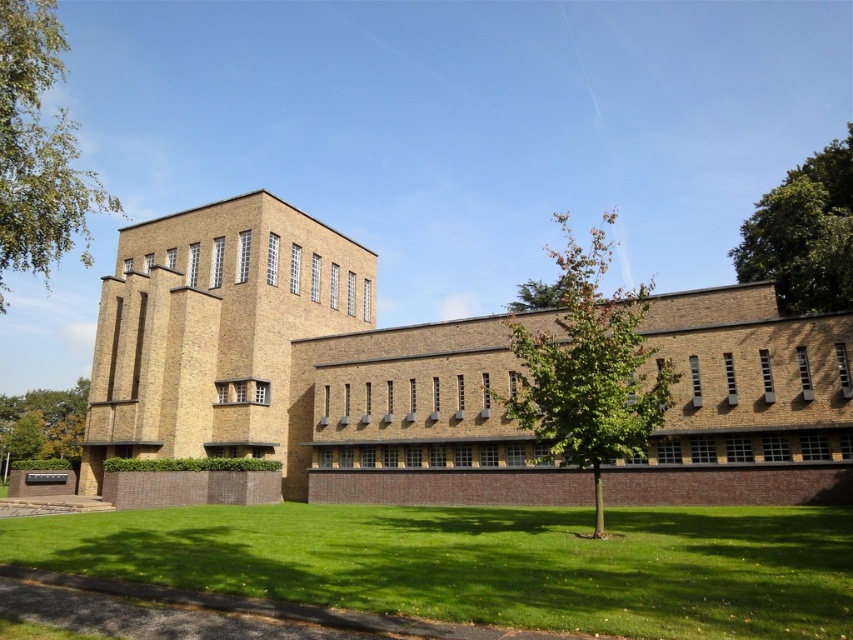
You are standing 20 meters away from the modernist building. You notice a green leafy tree at left. Is the tree closer to you than the building?

The distance of green leafy tree at left from viewer is 18.49 meters, so yes, the tree is closer to you than the building since it is only 18.49 meters away compared to your 20 meters distance from the building.

You are standing in front of the modernist building and notice two green leafy trees. One is labeled as the green leafy tree at left, and the other is the green leafy tree at lower left. Which tree would appear larger in the image?

The green leafy tree at left appears larger because it is closer to the viewer than the green leafy tree at lower left.

From the picture: You are a landscape architect planning to plant a new tree in front of the modernist building. You have two options from the image, the green leafy tree at left and the green leafy tree at lower left. Which tree would you choose if you want a more prominent visual impact in the design?

The green leafy tree at left has a larger size compared to the green leafy tree at lower left, so it would provide a more prominent visual impact in the design.